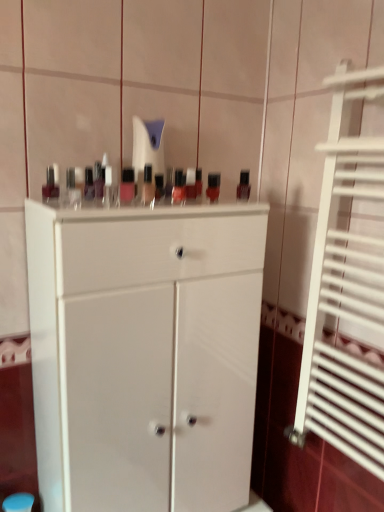
Question: Does matte plastic nail polish bottles at center, the second toiletry viewed from the back, lie in front of white matte cabinet at center?

Choices:
 (A) yes
 (B) no

Answer: (B)

Question: Is matte plastic nail polish bottles at center, the 1th toiletry positioned from the front, facing towards white matte cabinet at center?

Choices:
 (A) yes
 (B) no

Answer: (B)

Question: Is matte plastic nail polish bottles at center, the 1th toiletry positioned from the front, at the right side of white matte cabinet at center?

Choices:
 (A) yes
 (B) no

Answer: (B)

Question: Considering the relative sizes of matte plastic nail polish bottles at center, the 1th toiletry positioned from the front, and white matte cabinet at center in the image provided, is matte plastic nail polish bottles at center, the 1th toiletry positioned from the front, wider than white matte cabinet at center?

Choices:
 (A) yes
 (B) no

Answer: (B)

Question: Would you say matte plastic nail polish bottles at center, the second toiletry viewed from the back, is outside white matte cabinet at center?

Choices:
 (A) no
 (B) yes

Answer: (B)

Question: Does matte plastic nail polish bottles at center, the 1th toiletry positioned from the front, have a greater height compared to white matte cabinet at center?

Choices:
 (A) yes
 (B) no

Answer: (B)

Question: Can you confirm if matte black bottle at left, the third mouthwash when ordered from right to left, is positioned to the left of matte plastic nail polish bottles at center, the second toiletry viewed from the back?

Choices:
 (A) no
 (B) yes

Answer: (B)

Question: Is matte black bottle at left, marked as the first mouthwash in a left-to-right arrangement, taller than matte plastic nail polish bottles at center, the 1th toiletry positioned from the front?

Choices:
 (A) no
 (B) yes

Answer: (A)

Question: Does matte black bottle at left, which is the 1th mouthwash in front-to-back order, have a smaller size compared to matte plastic nail polish bottles at center, the 1th toiletry positioned from the front?

Choices:
 (A) no
 (B) yes

Answer: (B)

Question: From the image's perspective, is matte black bottle at left, which is the 3th mouthwash from back to front, beneath matte plastic nail polish bottles at center, the 1th toiletry positioned from the front?

Choices:
 (A) yes
 (B) no

Answer: (A)

Question: Considering the relative sizes of matte black bottle at left, which is the 3th mouthwash from back to front, and matte plastic nail polish bottles at center, the 1th toiletry positioned from the front, in the image provided, is matte black bottle at left, which is the 3th mouthwash from back to front, wider than matte plastic nail polish bottles at center, the 1th toiletry positioned from the front,?

Choices:
 (A) no
 (B) yes

Answer: (B)

Question: From the image's perspective, is matte black bottle at left, marked as the first mouthwash in a left-to-right arrangement, over matte plastic nail polish bottles at center, the second toiletry viewed from the back?

Choices:
 (A) yes
 (B) no

Answer: (B)

Question: Does matte plastic nail polish bottles at center, the 1th toiletry positioned from the front, appear on the left side of matte plastic mouthwash at center, marked as the 2th mouthwash in a front-to-back arrangement?

Choices:
 (A) no
 (B) yes

Answer: (B)